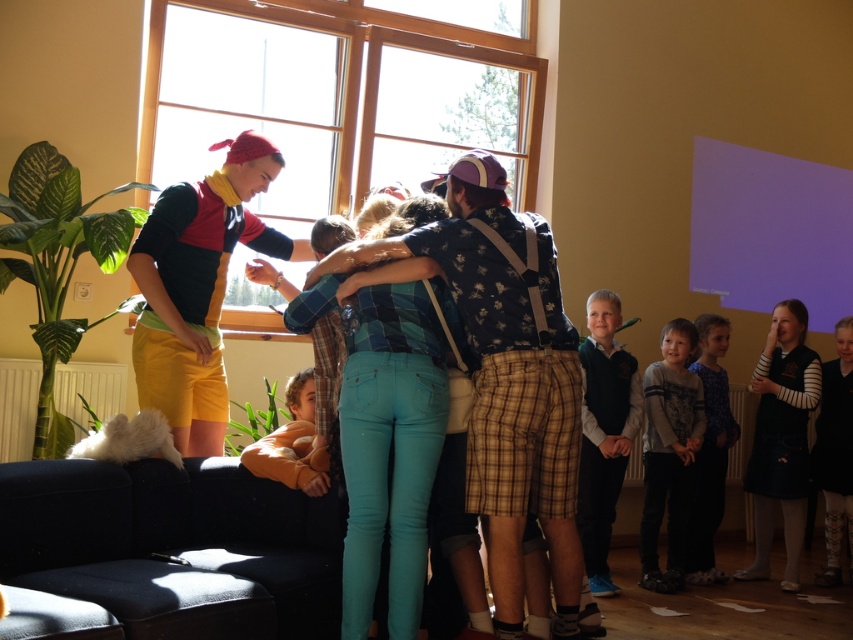
Who is lower down, dark blue sweater at lower right or black wool sweater at right?

Positioned lower is black wool sweater at right.

Can you confirm if dark blue sweater at lower right is thinner than black wool sweater at right?

No, dark blue sweater at lower right is not thinner than black wool sweater at right.

Between point (706, 369) and point (839, 540), which one is positioned behind?

Positioned behind is point (706, 369).

The image size is (853, 640). Identify the location of dark blue sweater at lower right. (711, 451).

From the picture: Can you confirm if dark blue sweater at right is shorter than orange plush toy at lower left?

No, dark blue sweater at right is not shorter than orange plush toy at lower left.

Who is higher up, dark blue sweater at right or orange plush toy at lower left?

orange plush toy at lower left is higher up.

Find the location of a particular element. Image resolution: width=853 pixels, height=640 pixels. dark blue sweater at right is located at coordinates pos(604,433).

Is matte yellow shorts at left positioned before black wool sweater at right?

Yes, it is in front of black wool sweater at right.

How far apart are matte yellow shorts at left and black wool sweater at right?

matte yellow shorts at left is 4.34 meters from black wool sweater at right.

In order to click on matte yellow shorts at left in this screenshot , I will do `click(198, 288)`.

This screenshot has height=640, width=853. Identify the location of matte yellow shorts at left. (198, 288).